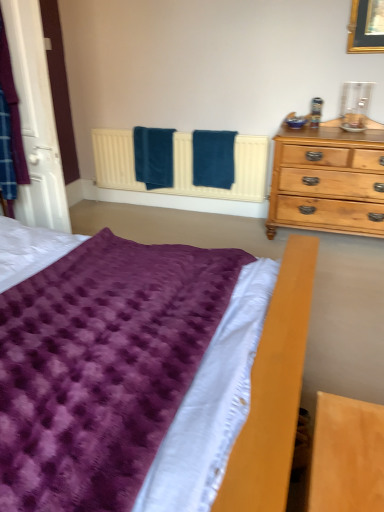
Question: In terms of width, does teal soft towel at center, the 2th bath towel positioned from the left, look wider or thinner when compared to purple fuzzy blanket at lower left?

Choices:
 (A) thin
 (B) wide

Answer: (A)

Question: Is teal soft towel at center, the 2th bath towel positioned from the left, bigger or smaller than purple fuzzy blanket at lower left?

Choices:
 (A) big
 (B) small

Answer: (B)

Question: Estimate the real-world distances between objects in this image. Which object is closer to the teal soft towel at center, the 1th bath towel from the right?

Choices:
 (A) blue soft towel at center, marked as the second bath towel in a right-to-left arrangement
 (B) purple fuzzy blanket at lower left

Answer: (A)

Question: Estimate the real-world distances between objects in this image. Which object is farther from the teal soft towel at center, the 2th bath towel positioned from the left?

Choices:
 (A) blue soft towel at center, marked as the second bath towel in a right-to-left arrangement
 (B) purple fuzzy blanket at lower left

Answer: (B)